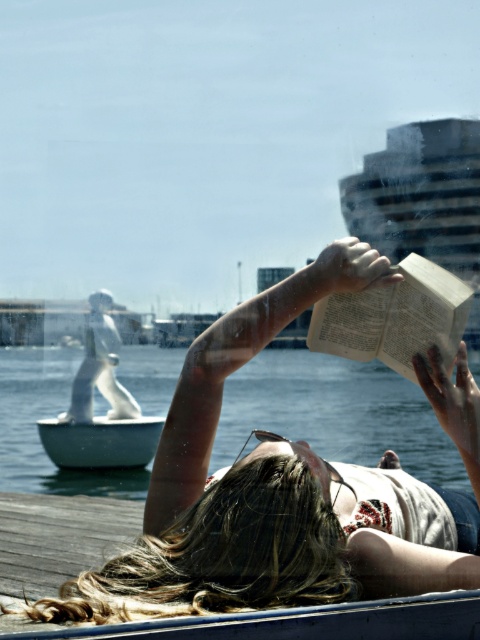
Who is positioned more to the left, smooth white hair at upper center or white paper book at upper right?

smooth white hair at upper center

Which is more to the right, smooth white hair at upper center or white paper book at upper right?

From the viewer's perspective, white paper book at upper right appears more on the right side.

Who is more distant from viewer, (453, 492) or (398, 342)?

The point (453, 492) is behind.

This screenshot has width=480, height=640. I want to click on smooth white hair at upper center, so click(x=286, y=490).

The height and width of the screenshot is (640, 480). In order to click on white paper book at upper right in this screenshot , I will do 395,317.

Does white paper book at upper right appear over white matte boat at lower left?

Indeed, white paper book at upper right is positioned over white matte boat at lower left.

Between point (355, 353) and point (140, 464), which one is positioned behind?

Point (140, 464)

Locate an element on the screen. The image size is (480, 640). white paper book at upper right is located at coordinates (395, 317).

Is the position of smooth white hair at upper center less distant than that of clear water at center?

Yes, smooth white hair at upper center is in front of clear water at center.

Between smooth white hair at upper center and clear water at center, which one has less height?

With less height is smooth white hair at upper center.

This screenshot has height=640, width=480. I want to click on smooth white hair at upper center, so click(x=286, y=490).